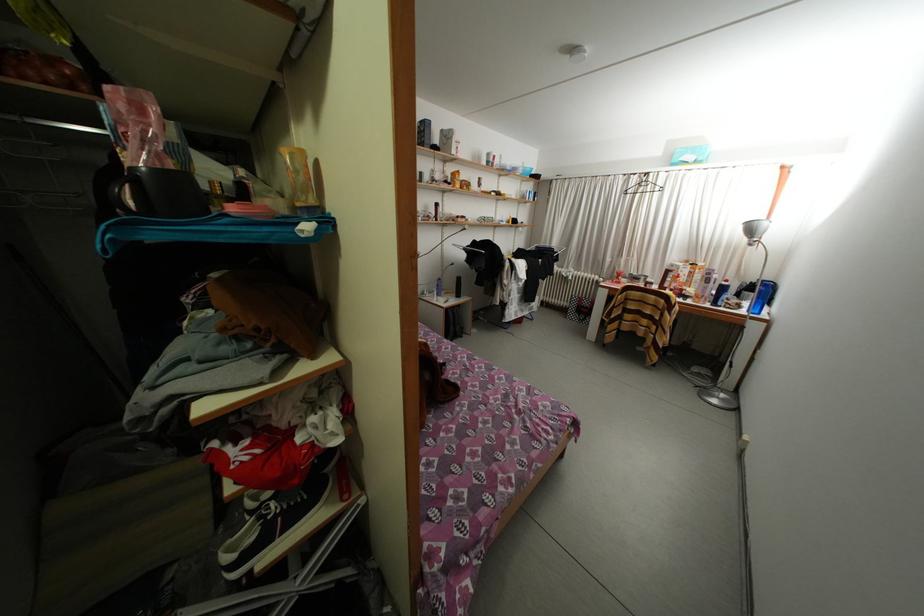
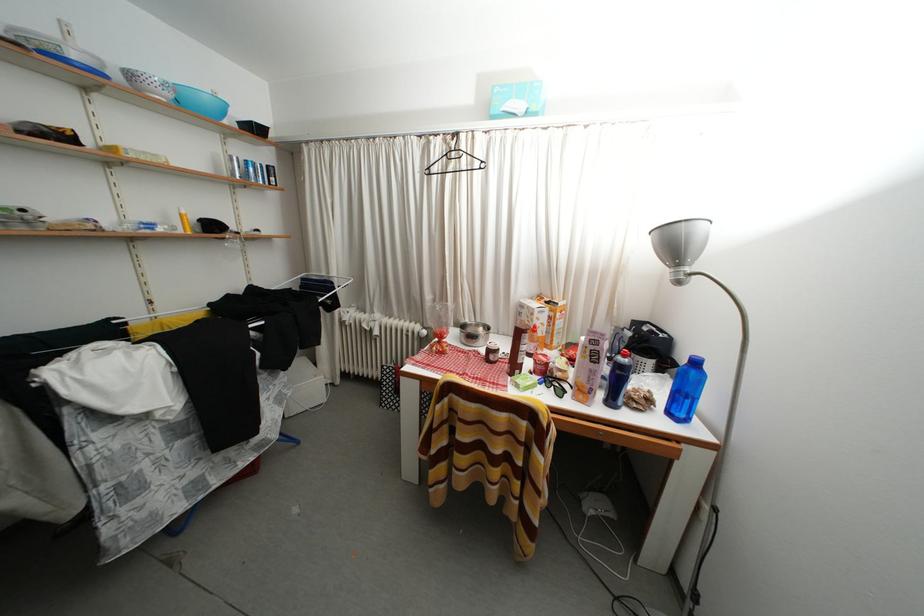
Find the pixel in the second image that matches (649,196) in the first image.

(458, 172)